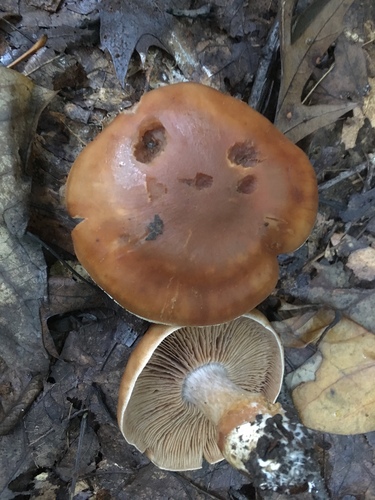
The image size is (375, 500). What are the coordinates of `floor` in the screenshot? It's located at (37, 318).